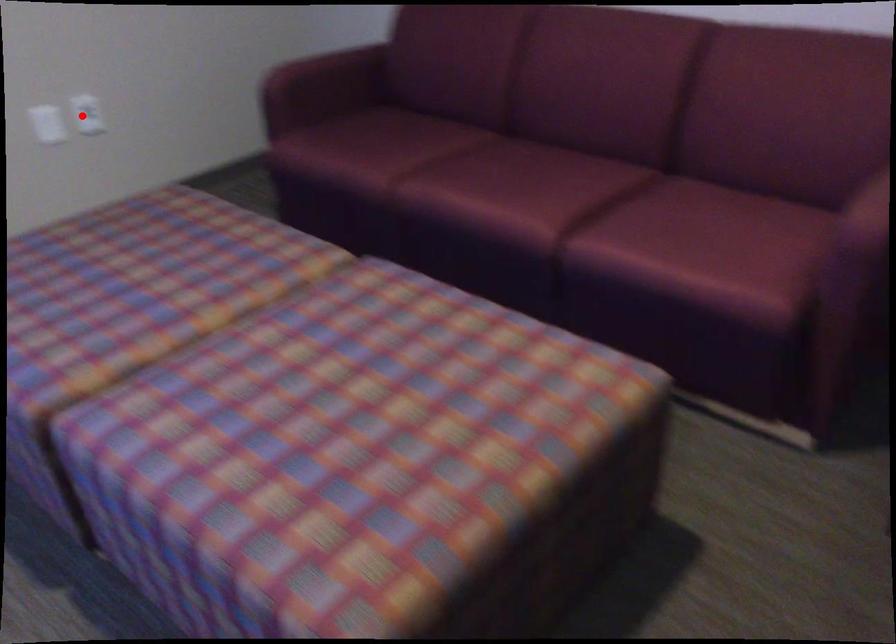
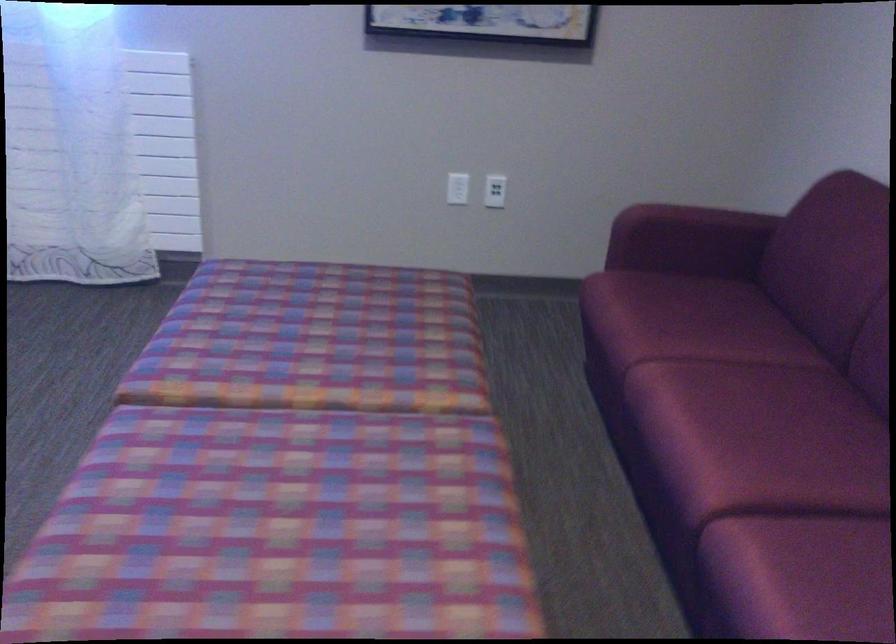
Find the pixel in the second image that matches the highlighted location in the first image.

(495, 191)